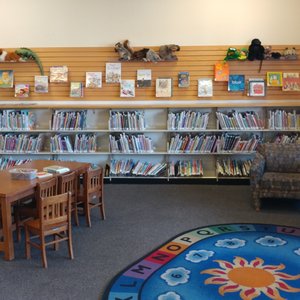
I want to click on sofa arm, so click(257, 166).